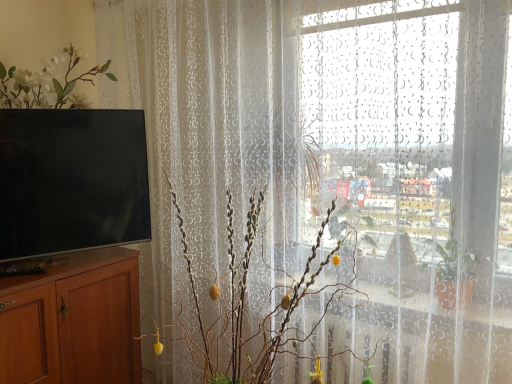
Question: Can you confirm if matte black tv at left is wider than brown wood cabinet at left?

Choices:
 (A) yes
 (B) no

Answer: (B)

Question: From the image's perspective, is matte black tv at left on top of brown wood cabinet at left?

Choices:
 (A) no
 (B) yes

Answer: (B)

Question: Is matte black tv at left outside of brown wood cabinet at left?

Choices:
 (A) no
 (B) yes

Answer: (B)

Question: Is matte black tv at left looking in the opposite direction of brown wood cabinet at left?

Choices:
 (A) no
 (B) yes

Answer: (A)

Question: Considering the relative sizes of matte black tv at left and brown wood cabinet at left in the image provided, is matte black tv at left shorter than brown wood cabinet at left?

Choices:
 (A) no
 (B) yes

Answer: (B)

Question: Is matte black tv at left bigger than brown wood cabinet at left?

Choices:
 (A) yes
 (B) no

Answer: (B)

Question: Would you say brown wood cabinet at left is part of silvery metallic branches at center's contents?

Choices:
 (A) no
 (B) yes

Answer: (A)

Question: Is silvery metallic branches at center bigger than brown wood cabinet at left?

Choices:
 (A) yes
 (B) no

Answer: (A)

Question: From a real-world perspective, is silvery metallic branches at center positioned over brown wood cabinet at left based on gravity?

Choices:
 (A) yes
 (B) no

Answer: (A)

Question: Does silvery metallic branches at center have a lesser height compared to brown wood cabinet at left?

Choices:
 (A) no
 (B) yes

Answer: (A)

Question: From a real-world perspective, is silvery metallic branches at center below brown wood cabinet at left?

Choices:
 (A) no
 (B) yes

Answer: (A)

Question: From the image's perspective, is silvery metallic branches at center beneath brown wood cabinet at left?

Choices:
 (A) yes
 (B) no

Answer: (B)

Question: Considering the relative sizes of brown wood cabinet at left and silvery metallic branches at center in the image provided, is brown wood cabinet at left bigger than silvery metallic branches at center?

Choices:
 (A) no
 (B) yes

Answer: (A)